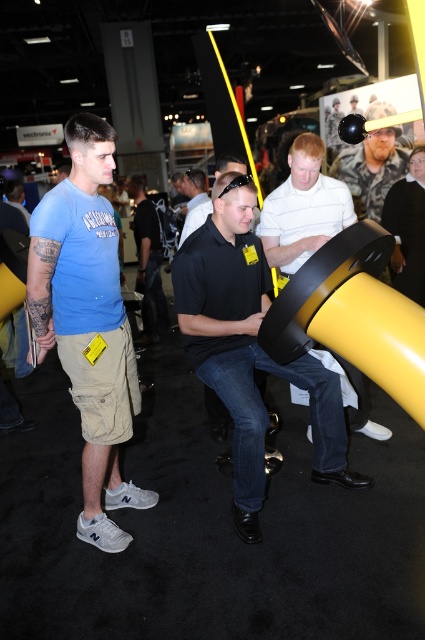
Describe the element at coordinates (249, 348) in the screenshot. I see `black matte steering wheel at center` at that location.

Who is more distant from viewer, (333, 380) or (342, 188)?

Point (342, 188)

Where is `black matte steering wheel at center`? The height and width of the screenshot is (640, 425). black matte steering wheel at center is located at coordinates coord(249,348).

Does blue cotton t-shirt at left have a greater width compared to black matte steering wheel at center?

No, blue cotton t-shirt at left is not wider than black matte steering wheel at center.

Can you confirm if blue cotton t-shirt at left is thinner than black matte steering wheel at center?

Correct, blue cotton t-shirt at left's width is less than black matte steering wheel at center's.

Where is `blue cotton t-shirt at left`? This screenshot has width=425, height=640. blue cotton t-shirt at left is located at coordinates [87, 321].

Find the location of `blue cotton t-shirt at left`. blue cotton t-shirt at left is located at coordinates (87, 321).

This screenshot has width=425, height=640. Describe the element at coordinates (87, 321) in the screenshot. I see `blue cotton t-shirt at left` at that location.

Is blue cotton t-shirt at left thinner than camouflage shirt at upper right?

In fact, blue cotton t-shirt at left might be wider than camouflage shirt at upper right.

The width and height of the screenshot is (425, 640). In order to click on blue cotton t-shirt at left in this screenshot , I will do `click(87, 321)`.